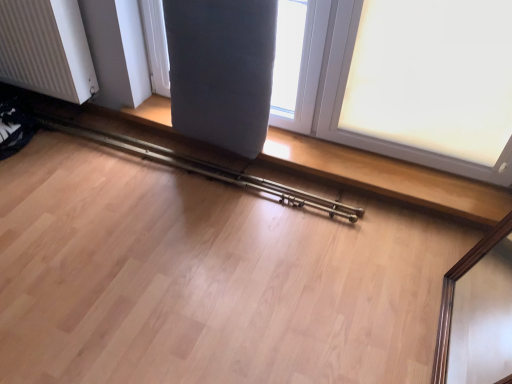
How much space does matte gray cushion at upper center, which is the 1th window from left to right, occupy vertically?

matte gray cushion at upper center, which is the 1th window from left to right, is 27.49 inches in height.

Locate an element on the screen. This screenshot has height=384, width=512. matte gray cushion at upper center, the second window positioned from the right is located at coordinates (297, 62).

What do you see at coordinates (375, 138) in the screenshot?
I see `white frosted glass at upper right, marked as the 1th window in a right-to-left arrangement` at bounding box center [375, 138].

Find the location of a particular element. The width and height of the screenshot is (512, 384). matte gray cushion at upper center, which is the 1th window from left to right is located at coordinates (297, 62).

Does metallic brass rail at lower center lie in front of white ribbed radiator at left?

No.

Considering the sizes of metallic brass rail at lower center and white ribbed radiator at left in the image, is metallic brass rail at lower center wider or thinner than white ribbed radiator at left?

Considering their sizes, metallic brass rail at lower center looks broader than white ribbed radiator at left.

From the image's perspective, is metallic brass rail at lower center located beneath white ribbed radiator at left?

Yes.

Can you confirm if white ribbed radiator at left is thinner than metallic brass rail at lower center?

Indeed, white ribbed radiator at left has a lesser width compared to metallic brass rail at lower center.

Considering the relative sizes of white ribbed radiator at left and metallic brass rail at lower center in the image provided, is white ribbed radiator at left smaller than metallic brass rail at lower center?

Incorrect, white ribbed radiator at left is not smaller in size than metallic brass rail at lower center.

Is white ribbed radiator at left taller or shorter than metallic brass rail at lower center?

Considering their sizes, white ribbed radiator at left has more height than metallic brass rail at lower center.

In the image, is white ribbed radiator at left on the left side or the right side of metallic brass rail at lower center?

white ribbed radiator at left is to the left of metallic brass rail at lower center.

Are matte gray cushion at upper center, which is the 1th window from left to right, and white ribbed radiator at left beside each other?

No, matte gray cushion at upper center, which is the 1th window from left to right, is not in contact with white ribbed radiator at left.

Is matte gray cushion at upper center, the second window positioned from the right, looking in the opposite direction of white ribbed radiator at left?

No, white ribbed radiator at left is not at the back of matte gray cushion at upper center, the second window positioned from the right.

From a real-world perspective, is matte gray cushion at upper center, which is the 1th window from left to right, physically below white ribbed radiator at left?

No.

Which object is closer to the camera, matte gray cushion at upper center, the second window positioned from the right, or white ribbed radiator at left?

Positioned in front is matte gray cushion at upper center, the second window positioned from the right.

From the metallic brass rail at lower center, count 2nd window to the right and point to it. Please provide its 2D coordinates.

[(375, 138)]

Based on the photo, considering the sizes of white frosted glass at upper right, marked as the 1th window in a right-to-left arrangement, and metallic brass rail at lower center in the image, is white frosted glass at upper right, marked as the 1th window in a right-to-left arrangement, wider or thinner than metallic brass rail at lower center?

Clearly, white frosted glass at upper right, marked as the 1th window in a right-to-left arrangement, has less width compared to metallic brass rail at lower center.

Between white frosted glass at upper right, marked as the 1th window in a right-to-left arrangement, and metallic brass rail at lower center, which one appears on the right side from the viewer's perspective?

white frosted glass at upper right, marked as the 1th window in a right-to-left arrangement, is more to the right.

Could you tell me if white frosted glass at upper right, positioned as the 2th window in left-to-right order, is turned towards metallic brass rail at lower center?

No, white frosted glass at upper right, positioned as the 2th window in left-to-right order, does not turn towards metallic brass rail at lower center.

Where is `window lying behind the white frosted glass at upper right, marked as the 1th window in a right-to-left arrangement`? Image resolution: width=512 pixels, height=384 pixels. window lying behind the white frosted glass at upper right, marked as the 1th window in a right-to-left arrangement is located at coordinates (297, 62).

Who is taller, white frosted glass at upper right, positioned as the 2th window in left-to-right order, or matte gray cushion at upper center, the second window positioned from the right?

white frosted glass at upper right, positioned as the 2th window in left-to-right order, is taller.

Considering the positions of point (329, 65) and point (311, 122), is point (329, 65) closer or farther from the camera than point (311, 122)?

Clearly, point (329, 65) is closer to the camera than point (311, 122).

Is there a large distance between white frosted glass at upper right, positioned as the 2th window in left-to-right order, and matte gray cushion at upper center, which is the 1th window from left to right?

No, there isn't a large distance between white frosted glass at upper right, positioned as the 2th window in left-to-right order, and matte gray cushion at upper center, which is the 1th window from left to right.

Consider the image. Is matte gray cushion at upper center, which is the 1th window from left to right, surrounded by white ribbed radiator at left?

Result: No.

Between white ribbed radiator at left and matte gray cushion at upper center, the second window positioned from the right, which one appears on the left side from the viewer's perspective?

white ribbed radiator at left is more to the left.

Can you confirm if white ribbed radiator at left is shorter than matte gray cushion at upper center, which is the 1th window from left to right?

Indeed, white ribbed radiator at left has a lesser height compared to matte gray cushion at upper center, which is the 1th window from left to right.

Consider the image. From the image's perspective, which one is positioned higher, white ribbed radiator at left or matte gray cushion at upper center, the second window positioned from the right?

white ribbed radiator at left, from the image's perspective.

Does matte gray cushion at upper center, which is the 1th window from left to right, lie behind metallic brass rail at lower center?

No.

Would you say matte gray cushion at upper center, the second window positioned from the right, is inside or outside metallic brass rail at lower center?

matte gray cushion at upper center, the second window positioned from the right, is not enclosed by metallic brass rail at lower center.

From the image's perspective, is matte gray cushion at upper center, the second window positioned from the right, on top of metallic brass rail at lower center?

Yes.

Locate an element on the screen. This screenshot has height=384, width=512. rail that is behind the matte gray cushion at upper center, the second window positioned from the right is located at coordinates tap(204, 168).

Locate an element on the screen. radiator that appears in front of the metallic brass rail at lower center is located at coordinates (46, 49).

This screenshot has width=512, height=384. In order to click on radiator above the metallic brass rail at lower center (from a real-world perspective) in this screenshot , I will do `click(46, 49)`.

Which object lies further to the anchor point white ribbed radiator at left, white frosted glass at upper right, marked as the 1th window in a right-to-left arrangement, or metallic brass rail at lower center?

The object further to white ribbed radiator at left is white frosted glass at upper right, marked as the 1th window in a right-to-left arrangement.

Consider the image. Looking at the image, which one is located closer to matte gray cushion at upper center, which is the 1th window from left to right, metallic brass rail at lower center or white ribbed radiator at left?

The object closer to matte gray cushion at upper center, which is the 1th window from left to right, is metallic brass rail at lower center.

Based on their spatial positions, is metallic brass rail at lower center or white ribbed radiator at left closer to white frosted glass at upper right, marked as the 1th window in a right-to-left arrangement?

metallic brass rail at lower center is closer to white frosted glass at upper right, marked as the 1th window in a right-to-left arrangement.

Based on their spatial positions, is white ribbed radiator at left or matte gray cushion at upper center, which is the 1th window from left to right, closer to white frosted glass at upper right, marked as the 1th window in a right-to-left arrangement?

Among the two, matte gray cushion at upper center, which is the 1th window from left to right, is located nearer to white frosted glass at upper right, marked as the 1th window in a right-to-left arrangement.

Looking at the image, which one is located closer to matte gray cushion at upper center, the second window positioned from the right, metallic brass rail at lower center or white frosted glass at upper right, positioned as the 2th window in left-to-right order?

white frosted glass at upper right, positioned as the 2th window in left-to-right order, lies closer to matte gray cushion at upper center, the second window positioned from the right, than the other object.

From the picture: Based on their spatial positions, is white frosted glass at upper right, positioned as the 2th window in left-to-right order, or metallic brass rail at lower center closer to matte gray cushion at upper center, the second window positioned from the right?

white frosted glass at upper right, positioned as the 2th window in left-to-right order, lies closer to matte gray cushion at upper center, the second window positioned from the right, than the other object.

Considering their positions, is white frosted glass at upper right, marked as the 1th window in a right-to-left arrangement, positioned closer to metallic brass rail at lower center than matte gray cushion at upper center, which is the 1th window from left to right?

matte gray cushion at upper center, which is the 1th window from left to right, is positioned closer to the anchor metallic brass rail at lower center.

Considering their positions, is white ribbed radiator at left positioned further to matte gray cushion at upper center, the second window positioned from the right, than metallic brass rail at lower center?

Among the two, white ribbed radiator at left is located further to matte gray cushion at upper center, the second window positioned from the right.

You are a GUI agent. You are given a task and a screenshot of the screen. Output one action in this format:
    pyautogui.click(x=<x>, y=<y>)
    Task: Click on the window located between white ribbed radiator at left and white frosted glass at upper right, marked as the 1th window in a right-to-left arrangement, in the left-right direction
    
    Given the screenshot: What is the action you would take?
    pyautogui.click(x=297, y=62)

At what (x,y) coordinates should I click in order to perform the action: click on rail between white ribbed radiator at left and white frosted glass at upper right, positioned as the 2th window in left-to-right order. Please return your answer as a coordinate pair (x, y). Looking at the image, I should click on (204, 168).

Where is `window between metallic brass rail at lower center and white frosted glass at upper right, positioned as the 2th window in left-to-right order, from left to right`? window between metallic brass rail at lower center and white frosted glass at upper right, positioned as the 2th window in left-to-right order, from left to right is located at coordinates (297, 62).

Where is `rail between white ribbed radiator at left and matte gray cushion at upper center, which is the 1th window from left to right, from left to right`? This screenshot has width=512, height=384. rail between white ribbed radiator at left and matte gray cushion at upper center, which is the 1th window from left to right, from left to right is located at coordinates (204, 168).